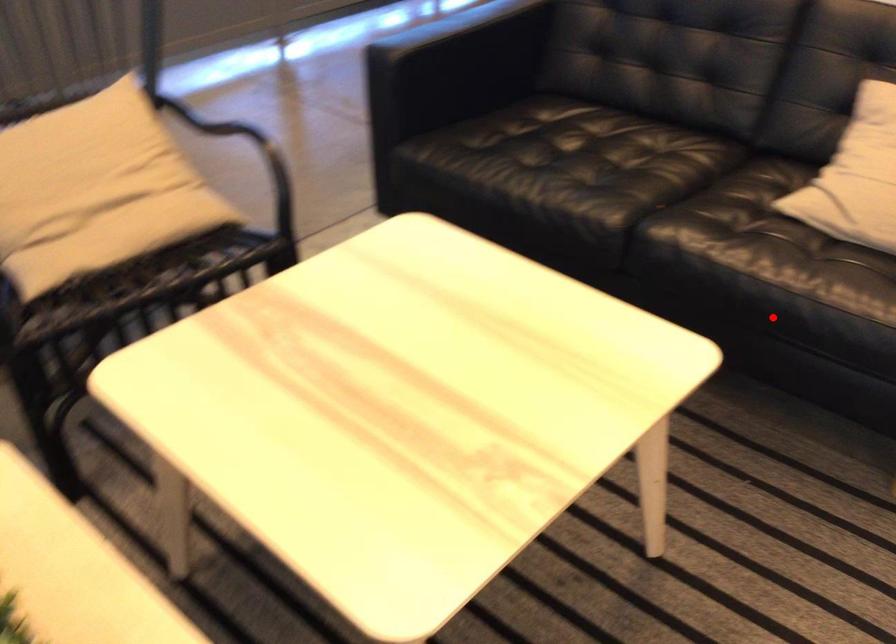
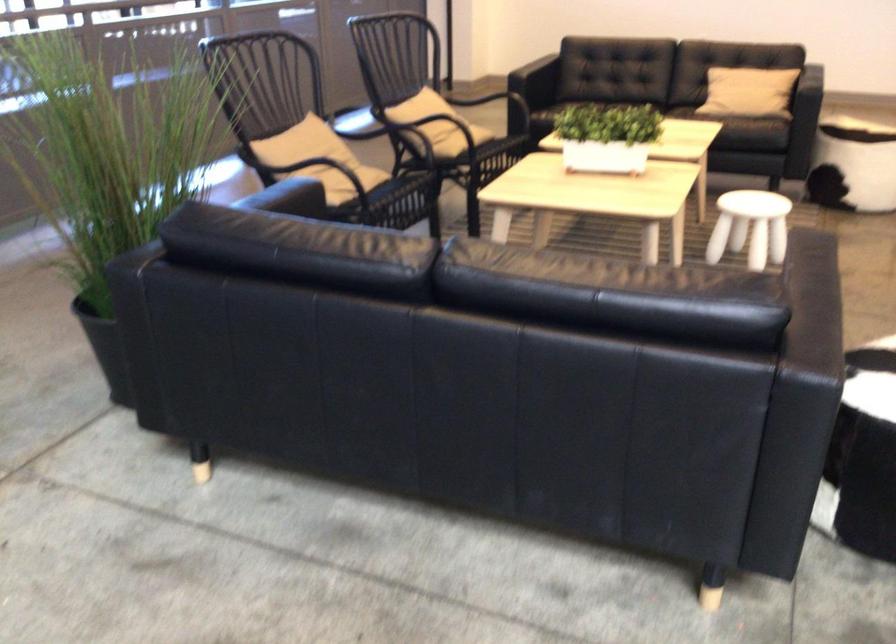
The point at the highlighted location is marked in the first image. Where is the corresponding point in the second image?

(745, 120)